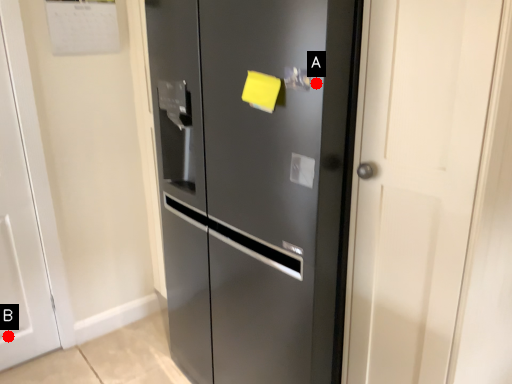
Question: Two points are circled on the image, labeled by A and B beside each circle. Among these points, which one is nearest to the camera?

Choices:
 (A) A is closer
 (B) B is closer

Answer: (A)